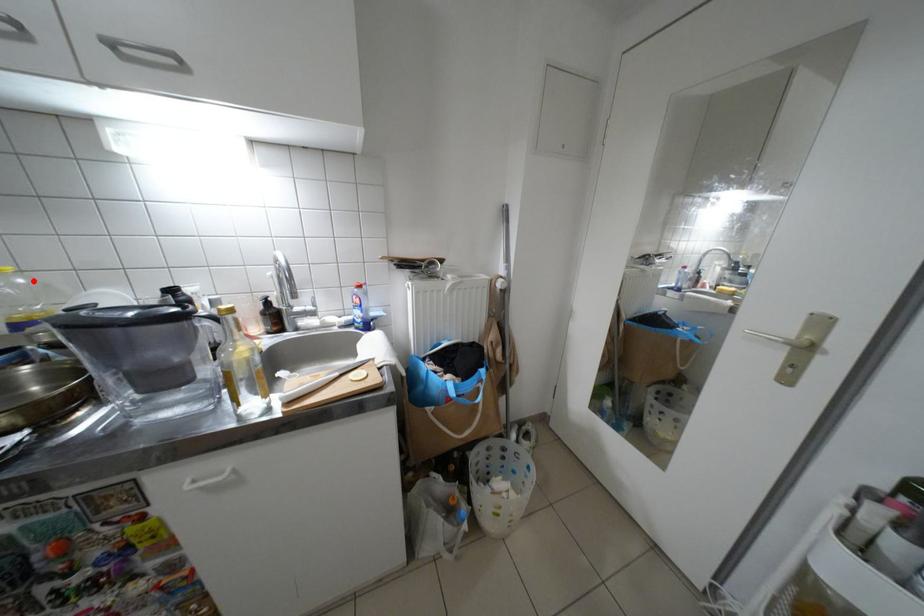
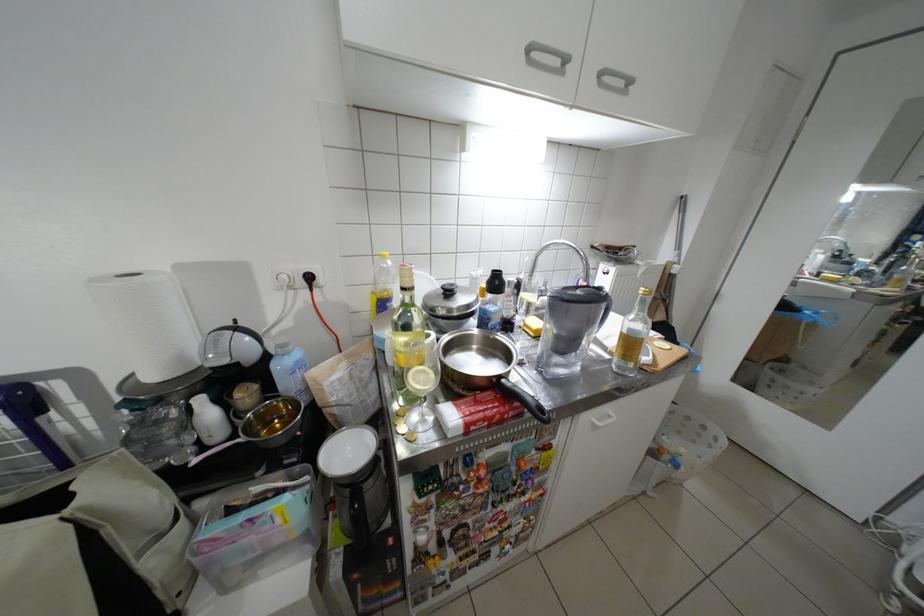
The point at the highlighted location is marked in the first image. Where is the corresponding point in the second image?

(400, 264)